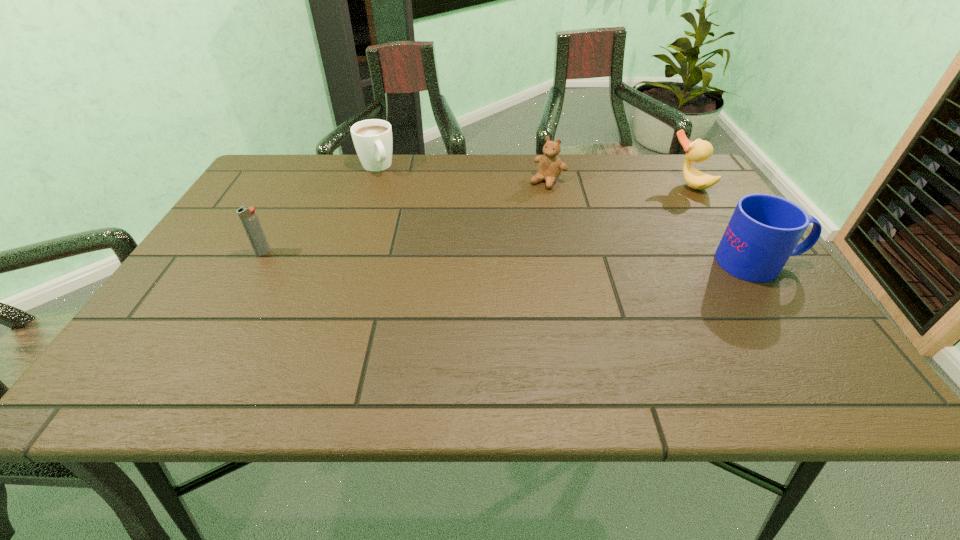
This screenshot has width=960, height=540. Identify the location of free point located 0.220m with the handle on the side of the cappuccino. (408, 217).

Find the location of a particular element. The width and height of the screenshot is (960, 540). vacant space located 0.310m with the handle on the side of the cappuccino is located at coordinates (420, 235).

The height and width of the screenshot is (540, 960). Find the location of `vacant space located 0.280m on the face of the third object from left to right`. vacant space located 0.280m on the face of the third object from left to right is located at coordinates (489, 242).

In order to click on vacant space situated 0.330m on the face of the third object from left to right in this screenshot , I will do `click(478, 254)`.

In order to click on vacant space located 0.250m on the face of the third object from left to right in this screenshot , I will do `click(495, 236)`.

The height and width of the screenshot is (540, 960). Find the location of `duck situated at the far edge`. duck situated at the far edge is located at coordinates (699, 150).

I want to click on cappuccino located in the far edge section of the desktop, so click(x=372, y=138).

Locate an element on the screen. The height and width of the screenshot is (540, 960). teddy bear that is at the far edge is located at coordinates (550, 166).

In order to click on object situated at the left edge in this screenshot , I will do pyautogui.click(x=248, y=216).

Identify the location of mug positioned at the right edge. The width and height of the screenshot is (960, 540). (764, 230).